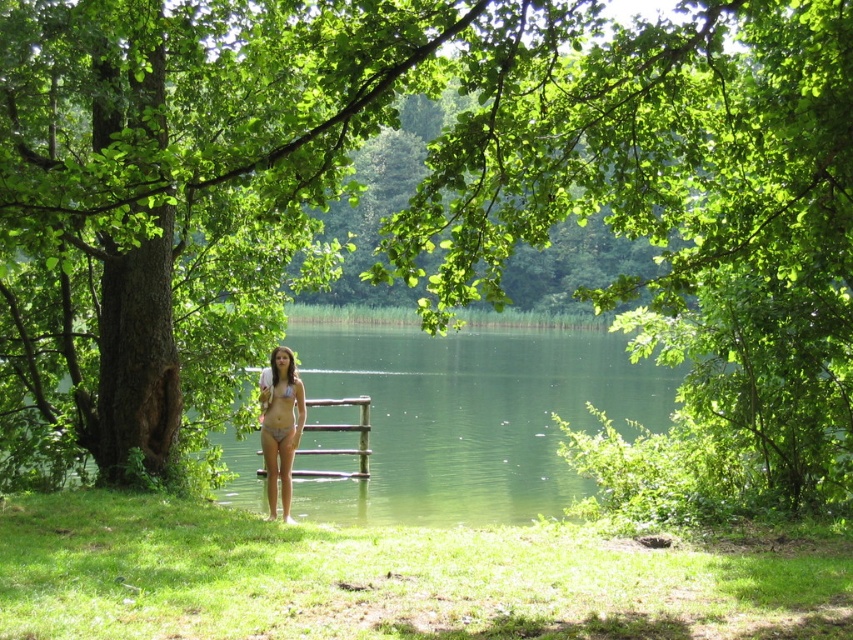
You are a photographer trying to capture the perfect shot of the white matte bikini at center and the matte white bikini top at center. Which one should you focus on if you want to highlight the larger object in the scene?

The white matte bikini at center is bigger than the matte white bikini top at center, so you should focus on the white matte bikini at center to highlight the larger object.

You are a photographer trying to capture the perfect shot of the two bikinis at the lakeside. Which of the two bikinis, the matte white bikini at center or the white matte bikini at center, is located to the left?

The matte white bikini at center is positioned to the left of the white matte bikini at center.

You are standing at the edge of the lake and notice two points marked on the dock. The first point is located at coordinates point (281, 353) and the second at point (280, 432). Which point is closer to you as you face the lake?

Point (281, 353) is closer to you because it is further to the camera than point (280, 432), meaning it appears nearer in the image.